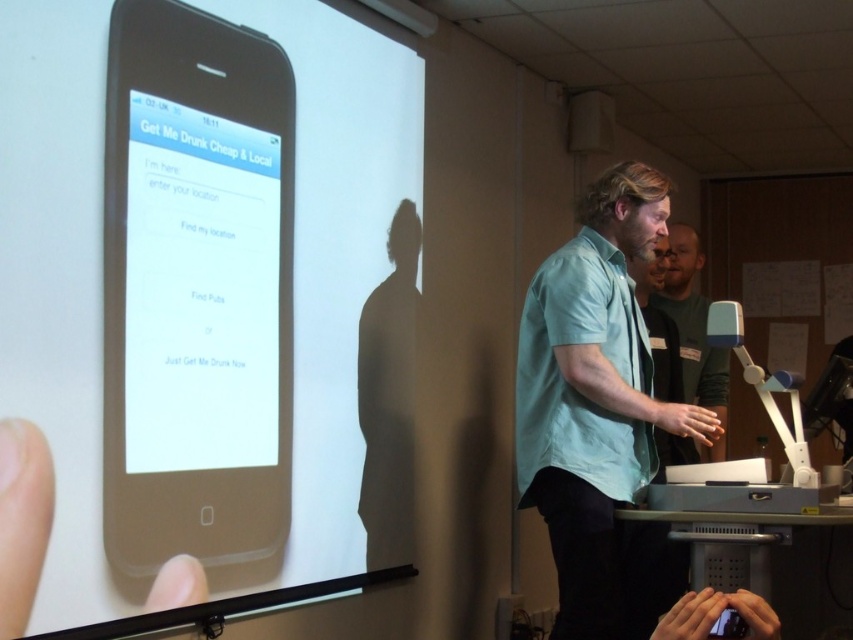
Question: Which point is closer to the camera?

Choices:
 (A) (642, 182)
 (B) (289, 442)
 (C) (691, 385)

Answer: (B)

Question: Is light blue cotton shirt at center closer to camera compared to dark green shirt at right?

Choices:
 (A) no
 (B) yes

Answer: (B)

Question: Which object is closer to the camera taking this photo?

Choices:
 (A) matte black phone at upper left
 (B) light blue cotton shirt at center

Answer: (A)

Question: Does light blue cotton shirt at center lie in front of dark green shirt at right?

Choices:
 (A) yes
 (B) no

Answer: (A)

Question: Does matte black phone at upper left have a greater width compared to dark green shirt at right?

Choices:
 (A) yes
 (B) no

Answer: (A)

Question: Which of the following is the farthest from the observer?

Choices:
 (A) matte black phone at upper left
 (B) light blue cotton shirt at center
 (C) dark green shirt at right

Answer: (C)